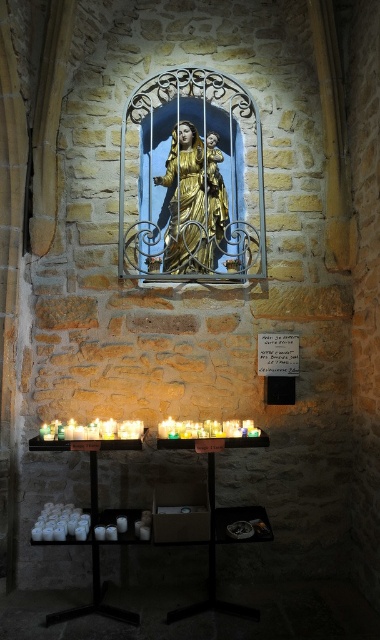
You are a visitor standing in front of the religious setting described. You notice two items at the center of the scene. Which one is closer to you, the gold painted glass at center or the gold leaf statue at center?

The gold painted glass at center is closer to you since it is positioned in front of the gold leaf statue at center.

You are a visitor standing in front of the religious setting described. You want to light a candle on the black matte table at lower center. However, you notice the gold leaf statue at center might be in the way. Can you light the candle without moving the statue?

The black matte table at lower center is positioned under the gold leaf statue at center, so the statue is above the table. Since the statue is above, it won not block access to the table. You can light the candle on the black matte table at lower center without moving the statue.